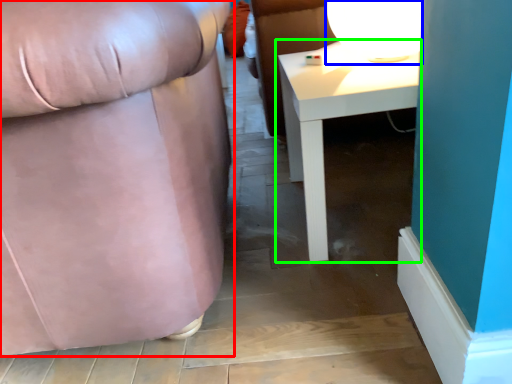
Question: Which object is the farthest from chair (highlighted by a red box)? Choose among these: table lamp (highlighted by a blue box) or table (highlighted by a green box).

Choices:
 (A) table lamp
 (B) table

Answer: (A)